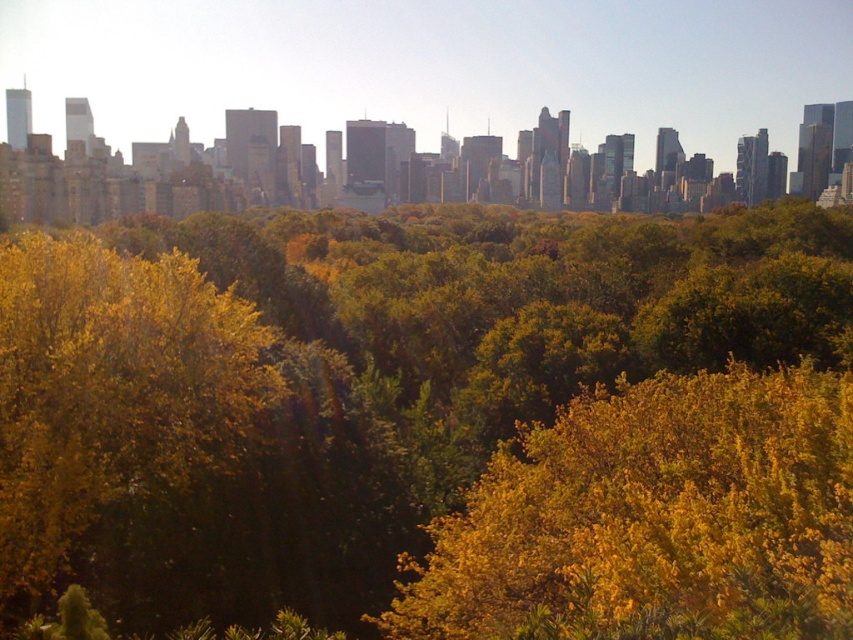
Question: Which object appears closest to the camera in this image?

Choices:
 (A) yellow-green foliage at center
 (B) golden textured leaves at center

Answer: (A)

Question: Which object is closer to the camera taking this photo?

Choices:
 (A) golden textured leaves at center
 (B) yellow leafy tree at left
 (C) yellow-green foliage at center

Answer: (B)

Question: Is yellow-green foliage at center positioned at the back of golden textured leaves at center?

Choices:
 (A) yes
 (B) no

Answer: (B)

Question: From the image, what is the correct spatial relationship of yellow-green foliage at center in relation to yellow leafy tree at left?

Choices:
 (A) above
 (B) below

Answer: (A)

Question: Can you confirm if golden textured leaves at center is thinner than yellow leafy tree at left?

Choices:
 (A) no
 (B) yes

Answer: (A)

Question: Which point is farther from the camera taking this photo?

Choices:
 (A) (22, 324)
 (B) (440, 577)

Answer: (B)